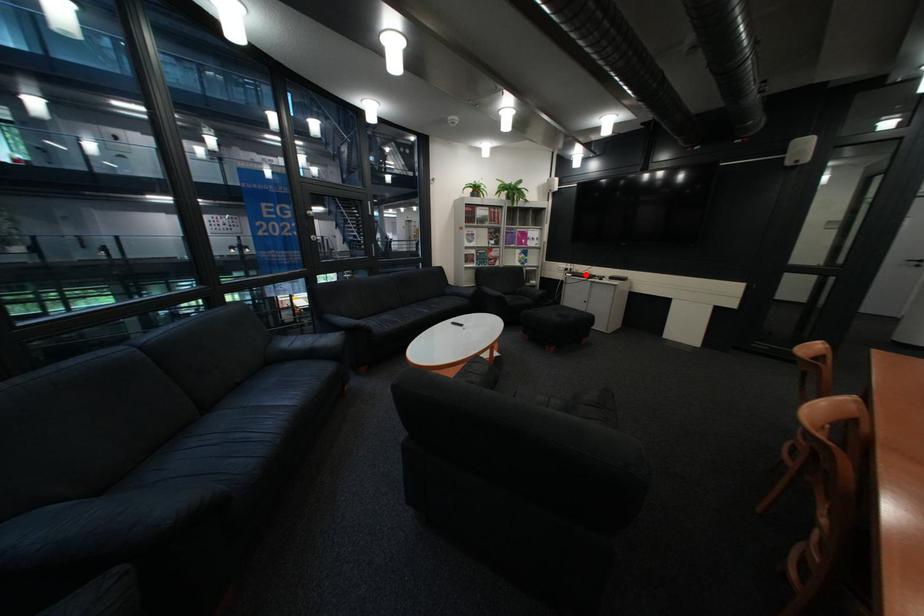
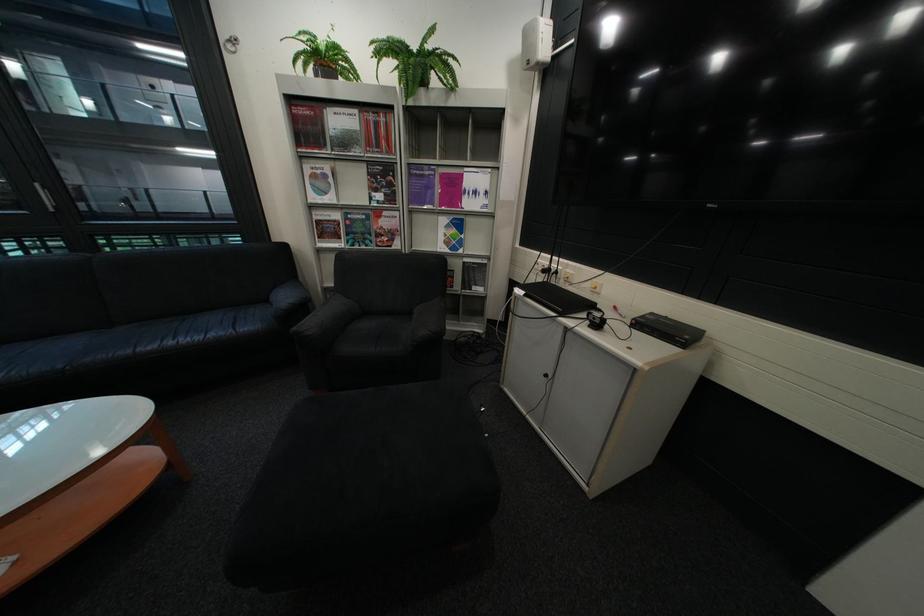
The point at the highlighted location is marked in the first image. Where is the corresponding point in the second image?

(538, 293)